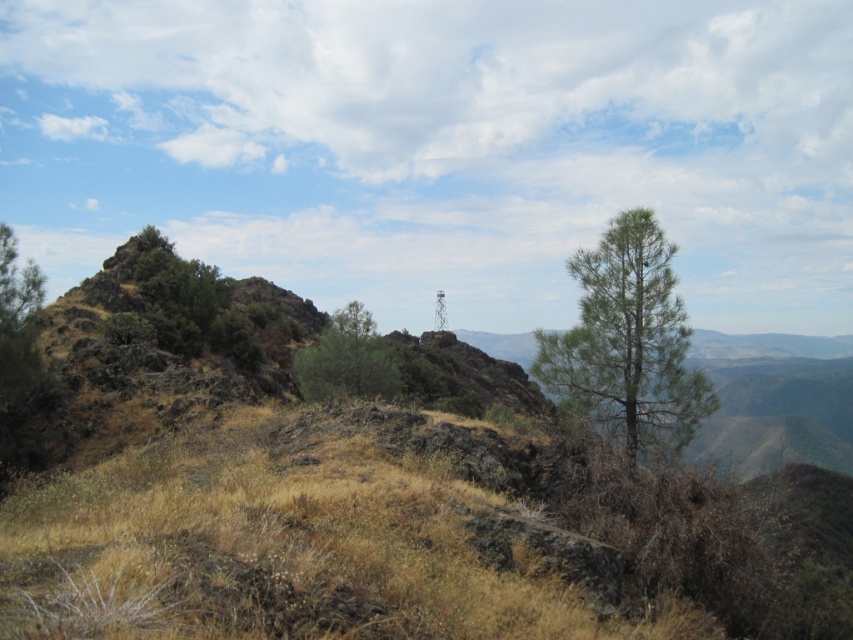
Does green rough rock at upper left appear under green leafy tree at center?

Actually, green rough rock at upper left is above green leafy tree at center.

Between point (170, 282) and point (311, 368), which one is positioned behind?

The point (170, 282) is behind.

I want to click on green rough rock at upper left, so click(175, 300).

From the picture: Can you confirm if green matte tree at center is positioned to the left of green rough rock at upper left?

In fact, green matte tree at center is to the right of green rough rock at upper left.

This screenshot has height=640, width=853. I want to click on green matte tree at center, so click(x=627, y=342).

Is green matte tree at center bigger than green leafy tree at center?

Actually, green matte tree at center might be smaller than green leafy tree at center.

Is point (619, 372) closer to viewer compared to point (296, 378)?

Yes, it is.

Who is more forward, (675,248) or (364,346)?

Point (675,248)

I want to click on green matte tree at center, so click(627, 342).